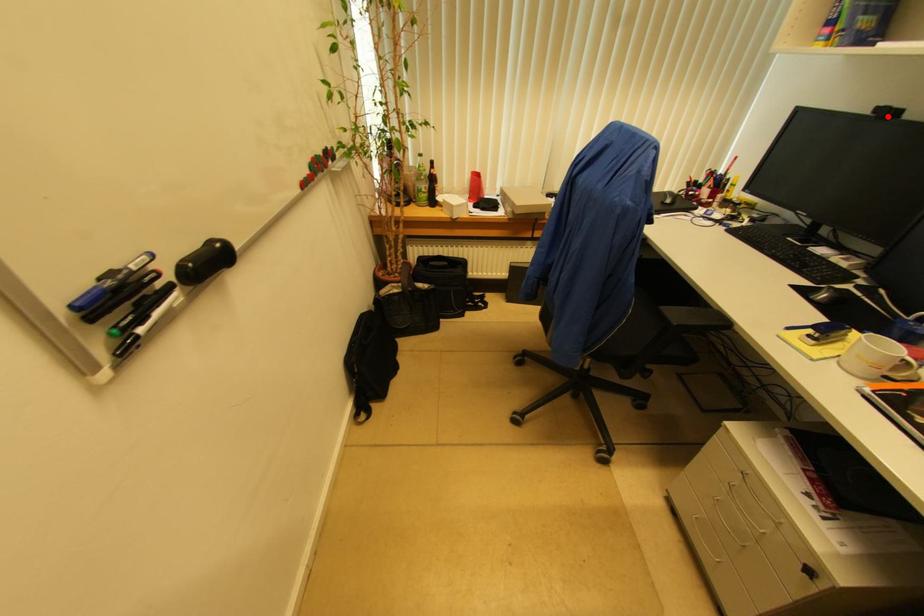
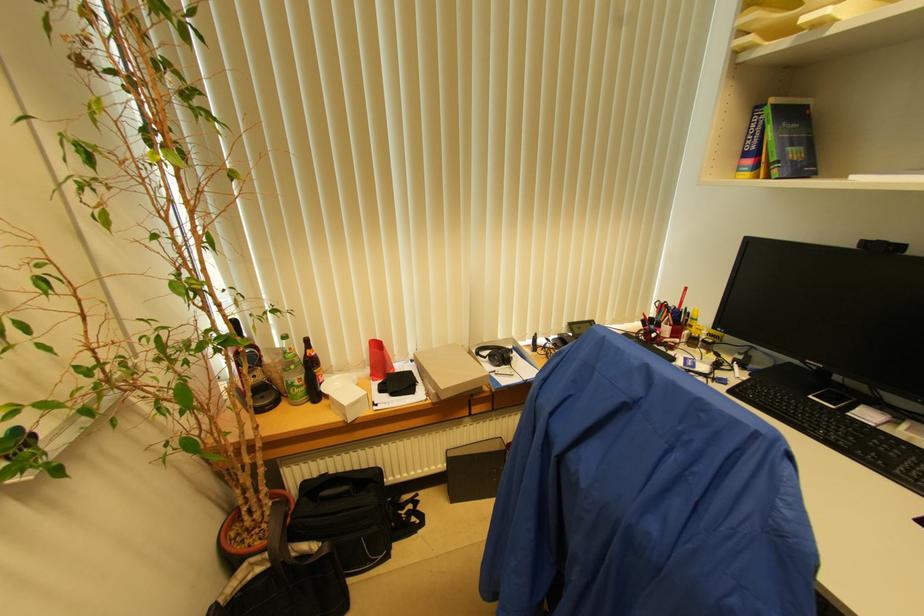
Question: I am providing you with two images of the same scene from different viewpoints. Given a red point in image1, look at the same physical point in image2. Is it:

Choices:
 (A) Closer to the viewpoint
 (B) Farther from the viewpoint

Answer: (A)